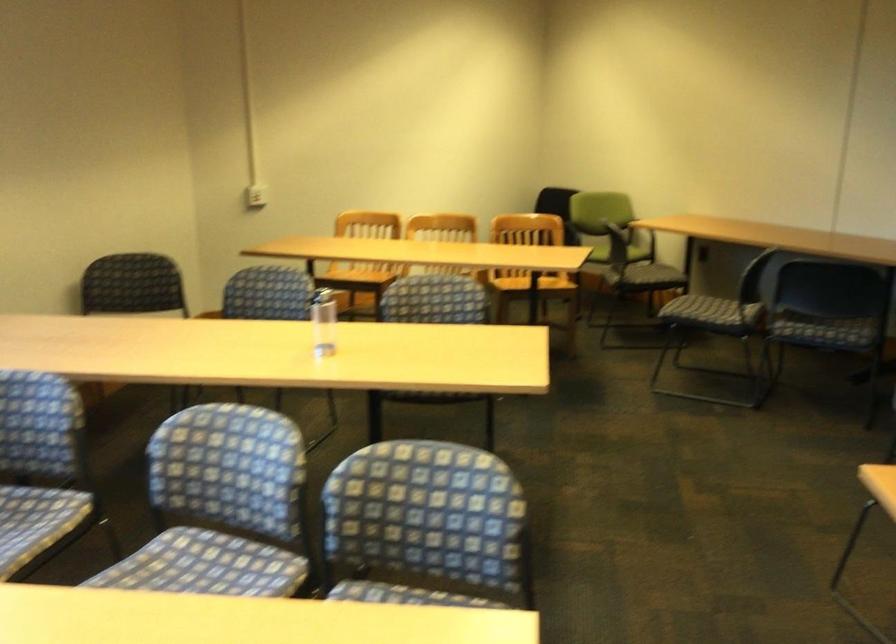
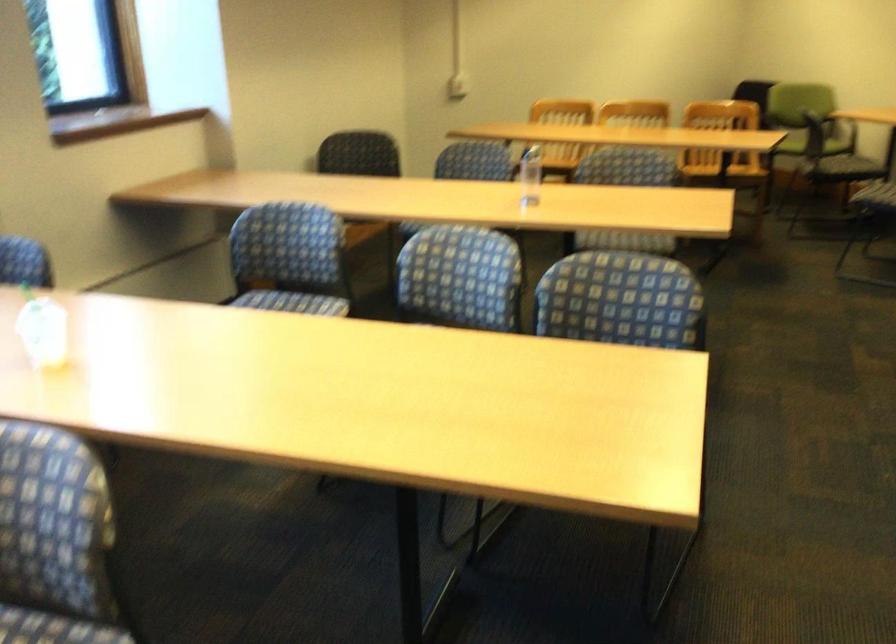
In the second image, find the point that corresponds to (x=428, y=509) in the first image.

(622, 301)